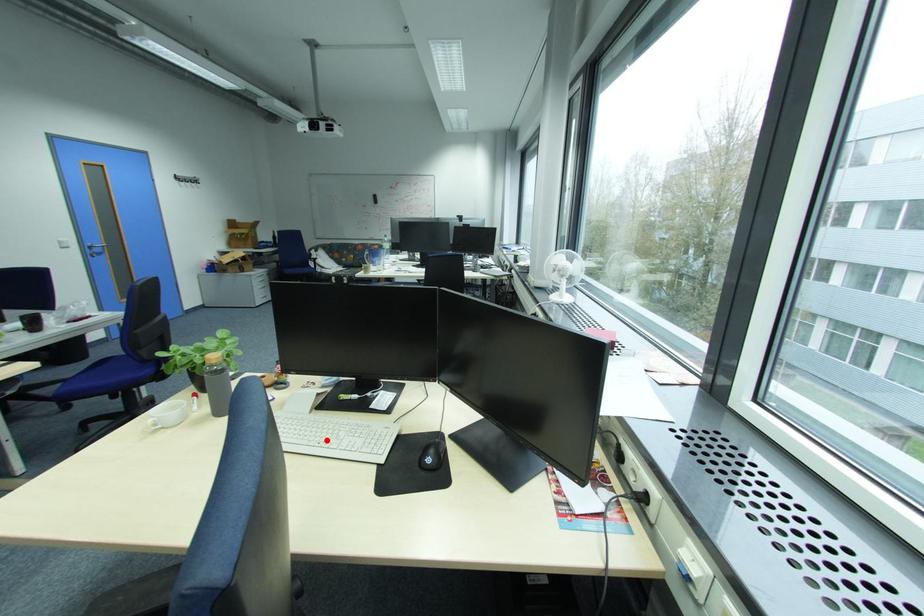
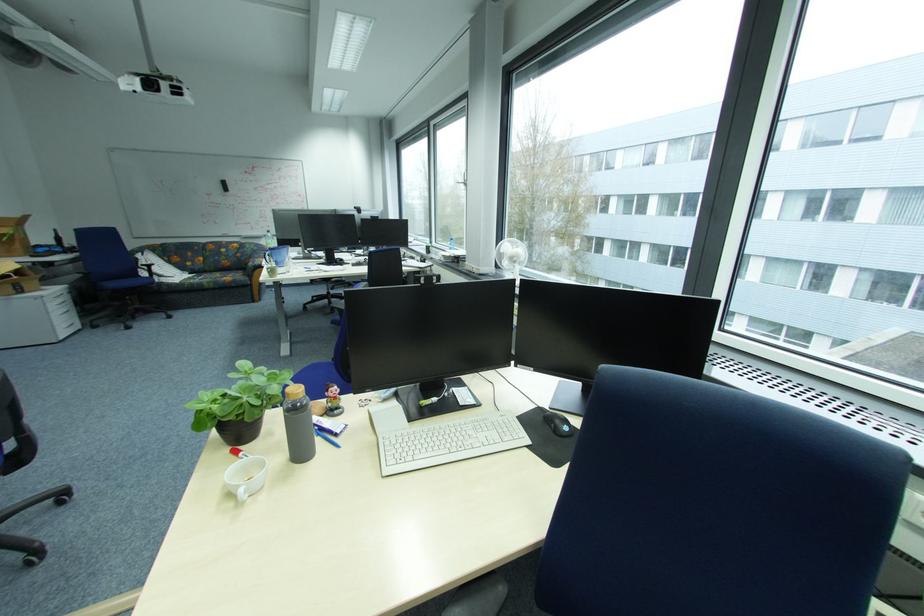
Locate, in the second image, the point that corresponds to the highlighted location in the first image.

(463, 445)